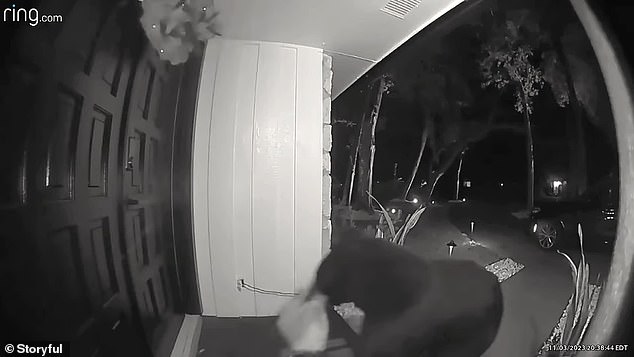
At what (x,y) coordinates should I click in order to perform the action: click on door lock on right door. Please return your answer as a coordinate pair (x, y). The height and width of the screenshot is (357, 634). Looking at the image, I should click on (130, 161).